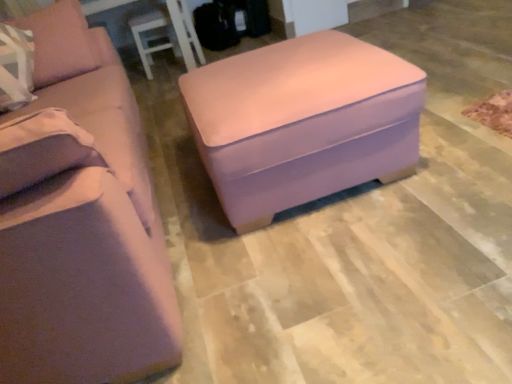
Question: Does matte pink fabric studio couch at center have a greater width compared to suede-like beige pillow at left?

Choices:
 (A) yes
 (B) no

Answer: (A)

Question: Is the surface of matte pink fabric studio couch at center in direct contact with suede-like beige pillow at left?

Choices:
 (A) no
 (B) yes

Answer: (A)

Question: Considering the relative sizes of matte pink fabric studio couch at center and suede-like beige pillow at left in the image provided, is matte pink fabric studio couch at center smaller than suede-like beige pillow at left?

Choices:
 (A) no
 (B) yes

Answer: (A)

Question: Is matte pink fabric studio couch at center at the right side of suede-like beige pillow at left?

Choices:
 (A) yes
 (B) no

Answer: (A)

Question: Considering the relative sizes of matte pink fabric studio couch at center and suede-like beige pillow at left in the image provided, is matte pink fabric studio couch at center bigger than suede-like beige pillow at left?

Choices:
 (A) yes
 (B) no

Answer: (A)

Question: Is matte pink fabric studio couch at center inside the boundaries of matte pink ottoman at center, or outside?

Choices:
 (A) inside
 (B) outside

Answer: (B)

Question: Considering the positions of matte pink fabric studio couch at center and matte pink ottoman at center in the image, is matte pink fabric studio couch at center wider or thinner than matte pink ottoman at center?

Choices:
 (A) thin
 (B) wide

Answer: (B)

Question: Is point (106, 311) closer or farther from the camera than point (246, 99)?

Choices:
 (A) closer
 (B) farther

Answer: (A)

Question: From a real-world perspective, relative to matte pink ottoman at center, is matte pink fabric studio couch at center vertically above or below?

Choices:
 (A) above
 (B) below

Answer: (A)

Question: Looking at the image, does matte pink fabric studio couch at center seem bigger or smaller compared to suede-like beige pillow at left?

Choices:
 (A) big
 (B) small

Answer: (A)

Question: Do you think matte pink fabric studio couch at center is within suede-like beige pillow at left, or outside of it?

Choices:
 (A) outside
 (B) inside

Answer: (A)

Question: Is matte pink fabric studio couch at center wider or thinner than suede-like beige pillow at left?

Choices:
 (A) wide
 (B) thin

Answer: (A)

Question: From a real-world perspective, is matte pink fabric studio couch at center above or below suede-like beige pillow at left?

Choices:
 (A) below
 (B) above

Answer: (A)

Question: From a real-world perspective, is suede-like beige pillow at left above or below matte pink ottoman at center?

Choices:
 (A) below
 (B) above

Answer: (B)

Question: Is suede-like beige pillow at left spatially inside matte pink ottoman at center, or outside of it?

Choices:
 (A) outside
 (B) inside

Answer: (A)